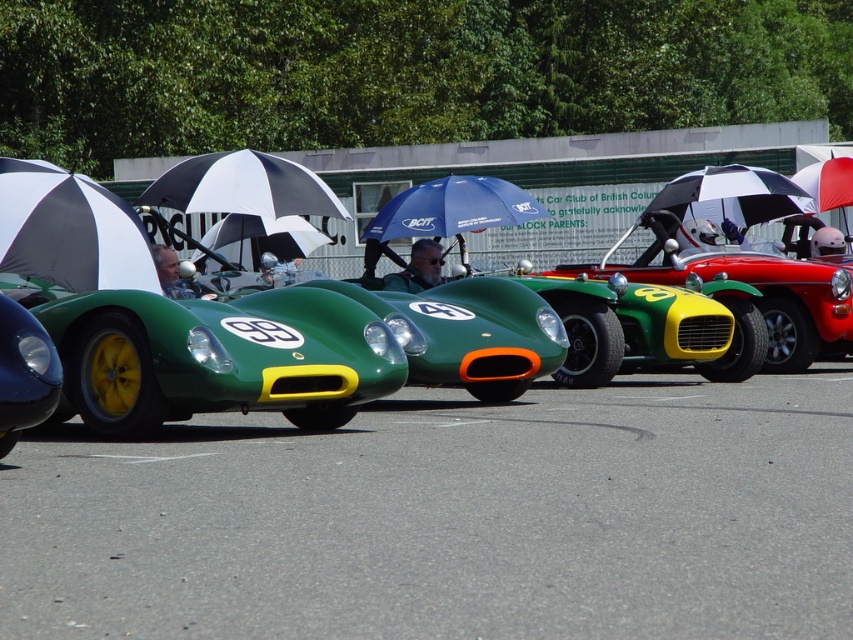
You are standing at the point marked by the coordinates point [242,186]. What object are you directly standing on?

You are directly standing on the black and white striped umbrella at center because the point [242,186] is located on it.

You are a photographer setting up a shoot at the vintage racing car event. You need to place a white and black striped umbrella at center and a matte black helmet at center in the scene. Given their sizes, which object will block more sunlight when placed at the center?

The white and black striped umbrella at center is much taller than the matte black helmet at center, so it will block more sunlight when placed at the center.